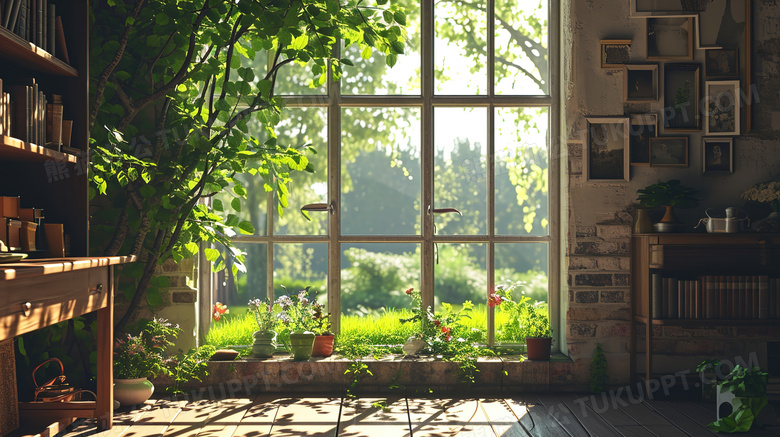
Where is `book on top shelf of bookcase`? The width and height of the screenshot is (780, 437). book on top shelf of bookcase is located at coordinates (64, 53), (54, 42), (45, 27), (41, 31), (34, 22), (29, 27), (20, 31), (13, 22), (9, 8).